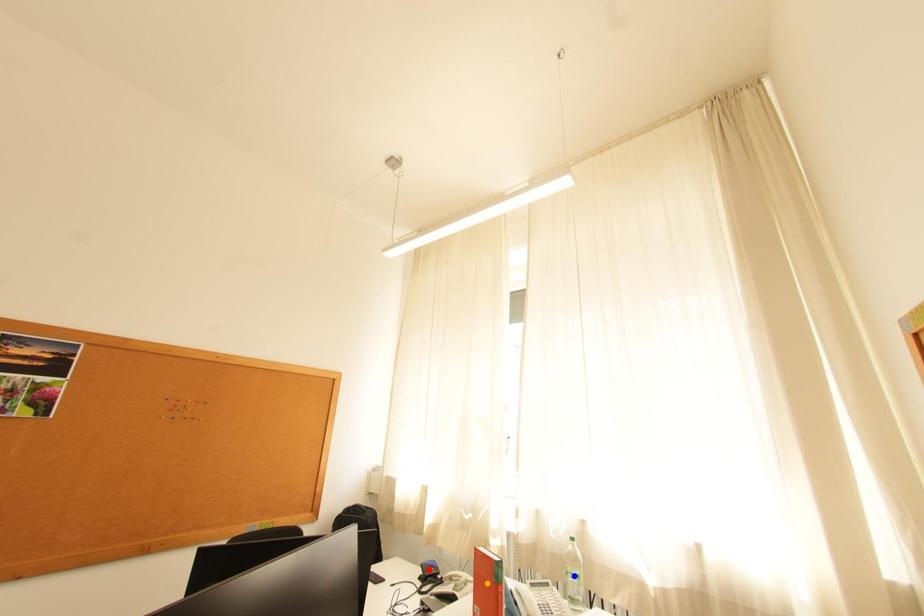
Order these from nearest to farthest:
red point
blue point
orange point

1. orange point
2. blue point
3. red point